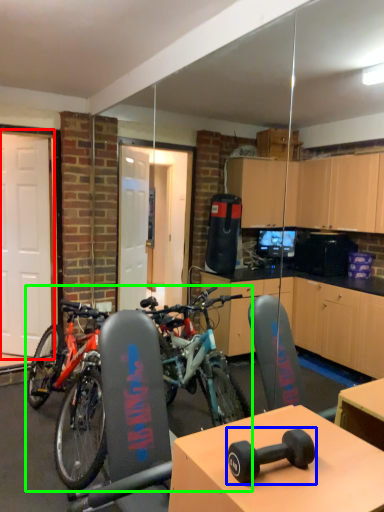
Question: Which object is positioned farthest from garage door (highlighted by a red box)? Select from dumbbell (highlighted by a blue box) and bicycle (highlighted by a green box).

Choices:
 (A) dumbbell
 (B) bicycle

Answer: (A)